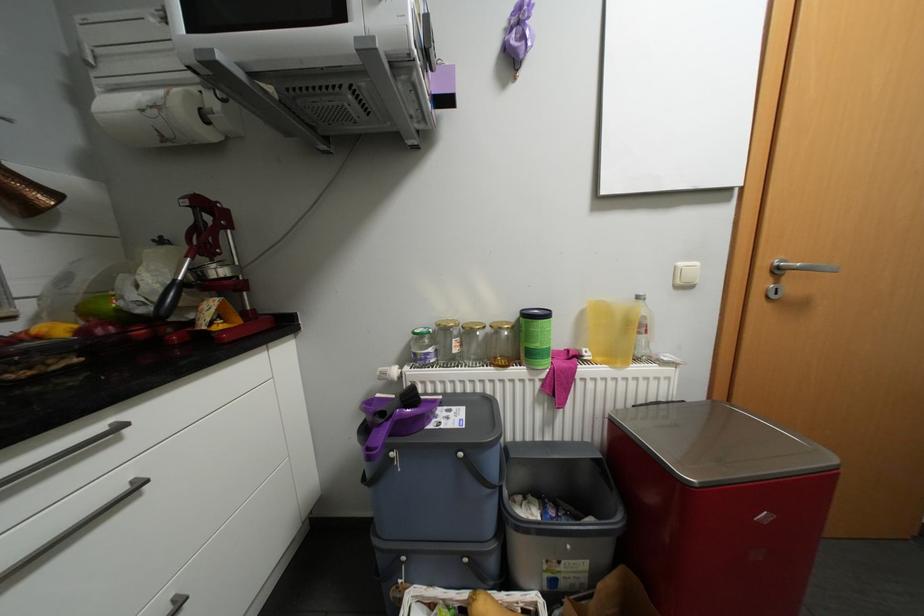
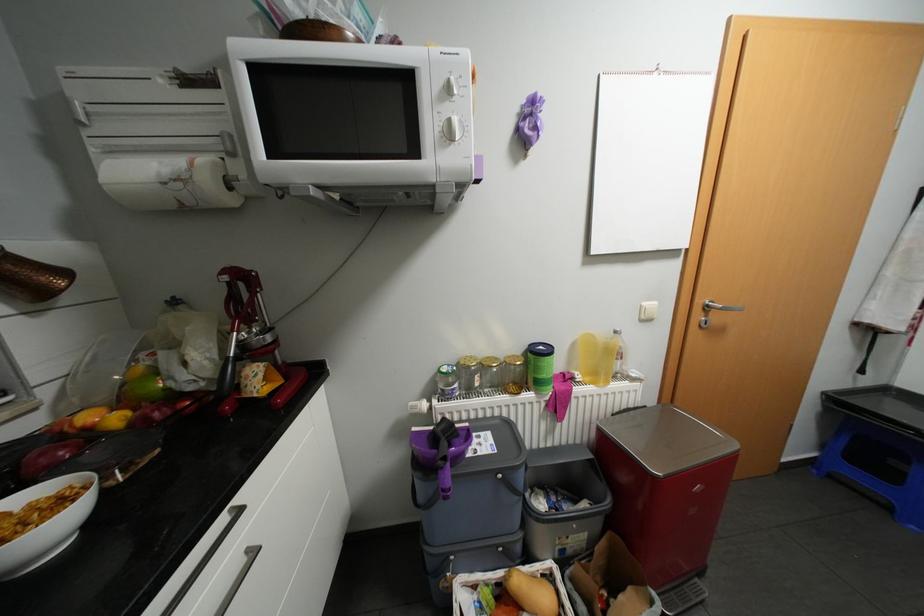
Where in the second image is the point corresponding to (438,349) from the first image?

(464, 384)